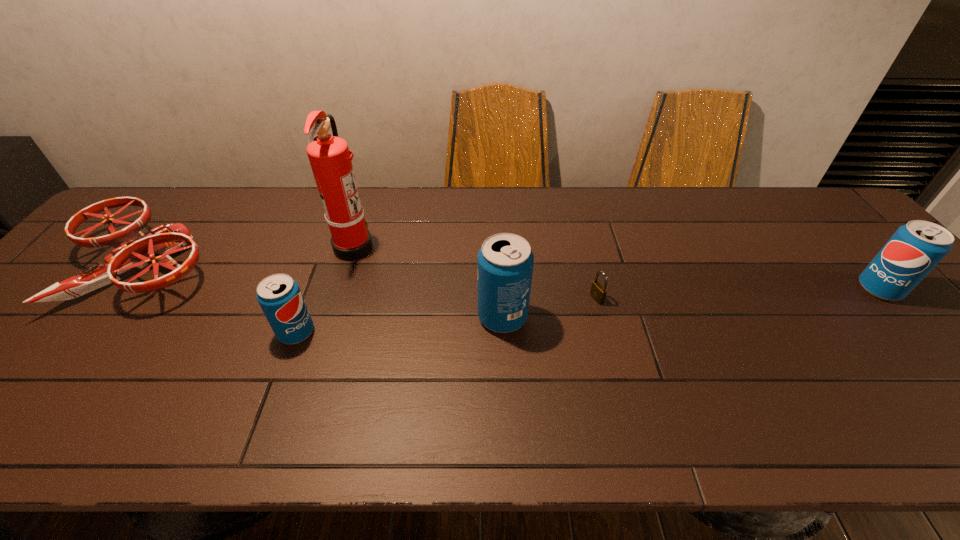
In order to click on object at the far left corner in this screenshot , I will do `click(135, 249)`.

You are a GUI agent. You are given a task and a screenshot of the screen. Output one action in this format:
    pyautogui.click(x=<x>, y=<y>)
    Task: Click on the vacant position at the far edge of the desktop
    The height and width of the screenshot is (540, 960).
    Given the screenshot: What is the action you would take?
    pyautogui.click(x=396, y=228)

This screenshot has width=960, height=540. Identify the location of free location at the near edge of the desktop. (198, 379).

Locate an element on the screen. The width and height of the screenshot is (960, 540). free space at the right edge is located at coordinates (867, 308).

In the image, there is a desktop. In order to click on free region at the far right corner in this screenshot , I will do `click(842, 222)`.

Locate an element on the screen. The width and height of the screenshot is (960, 540). free space between the leftmost soda can and the fourth object from left to right is located at coordinates (399, 325).

Find the location of a particular element. The image size is (960, 540). vacant space in between the fire extinguisher and the shortest soda can is located at coordinates (325, 289).

Where is `free point between the fire extinguisher and the leftmost object`? This screenshot has height=540, width=960. free point between the fire extinguisher and the leftmost object is located at coordinates (251, 257).

Identify the location of empty space between the second soda can from left to right and the drone. This screenshot has height=540, width=960. (324, 292).

At what (x,y) coordinates should I click in order to perform the action: click on empty location between the shortest soda can and the second soda can from right to left. Please return your answer as a coordinate pair (x, y). This screenshot has width=960, height=540. Looking at the image, I should click on (399, 325).